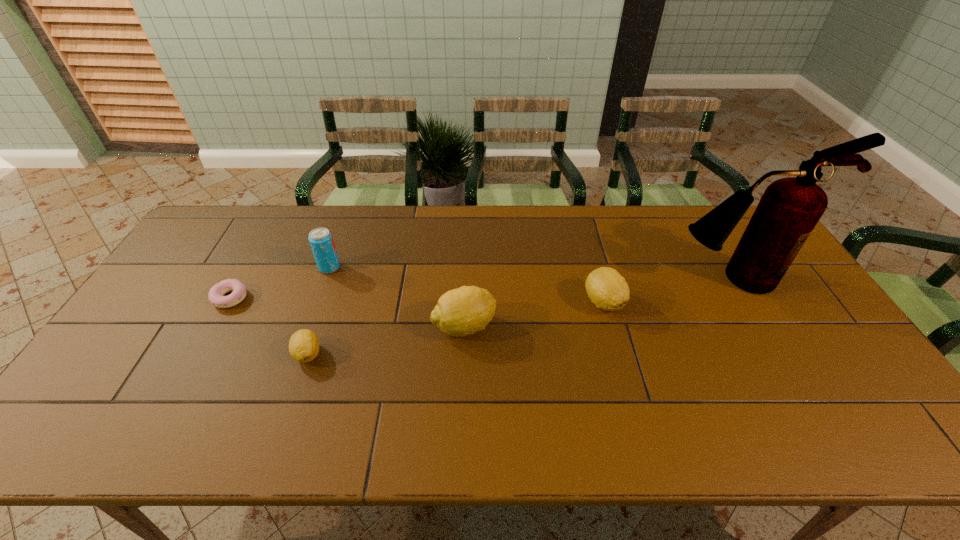
Image resolution: width=960 pixels, height=540 pixels. In order to click on vacant space at the right edge of the desktop in this screenshot , I will do `click(853, 366)`.

Find the location of a particular element. The width and height of the screenshot is (960, 540). vacant space at the near left corner of the desktop is located at coordinates (100, 394).

Locate an element on the screen. Image resolution: width=960 pixels, height=540 pixels. free space between the fourth object from left to right and the fifth tallest object is located at coordinates [x=386, y=340].

The width and height of the screenshot is (960, 540). I want to click on vacant point located between the shortest lemon and the third object from right to left, so click(x=386, y=340).

Find the location of a particular element. This screenshot has height=540, width=960. free area in between the rightmost lemon and the second lemon from left to right is located at coordinates (534, 314).

Locate an element on the screen. This screenshot has width=960, height=540. free space between the second lemon from right to left and the leftmost object is located at coordinates (347, 312).

At what (x,y) coordinates should I click in order to perform the action: click on free area in between the doughnut and the second shortest lemon. Please return your answer as a coordinate pair (x, y). Looking at the image, I should click on (417, 300).

I want to click on vacant space that is in between the second lemon from left to right and the soda can, so click(396, 296).

Identify the location of empty space between the tallest object and the soda can. click(x=531, y=273).

Find the location of a particular element. The height and width of the screenshot is (540, 960). free space that is in between the second shortest object and the fire extinguisher is located at coordinates (520, 316).